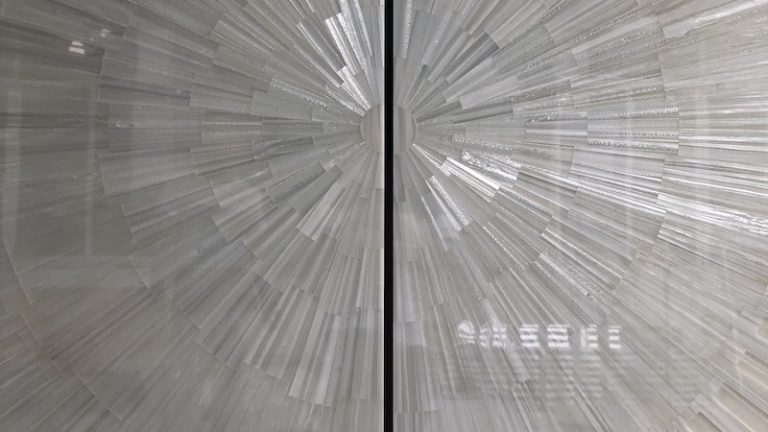
You are a GUI agent. You are given a task and a screenshot of the screen. Output one action in this format:
    pyautogui.click(x=<x>, y=<y>)
    Task: Click on the reflection of window in background
    The height and width of the screenshot is (432, 768).
    Given the screenshot: What is the action you would take?
    pyautogui.click(x=80, y=177), pyautogui.click(x=91, y=257), pyautogui.click(x=8, y=58), pyautogui.click(x=93, y=289), pyautogui.click(x=94, y=74), pyautogui.click(x=15, y=256)